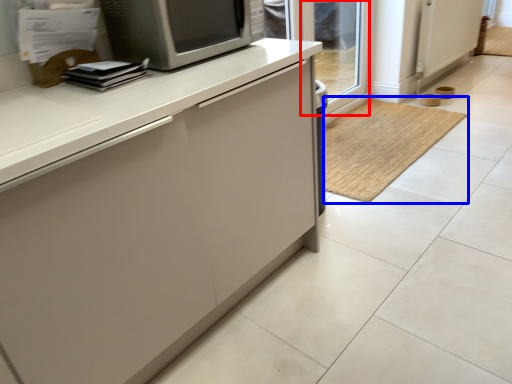
Question: Which point is closer to the camera, glass door (highlighted by a red box) or doormat (highlighted by a blue box)?

Choices:
 (A) glass door
 (B) doormat

Answer: (B)